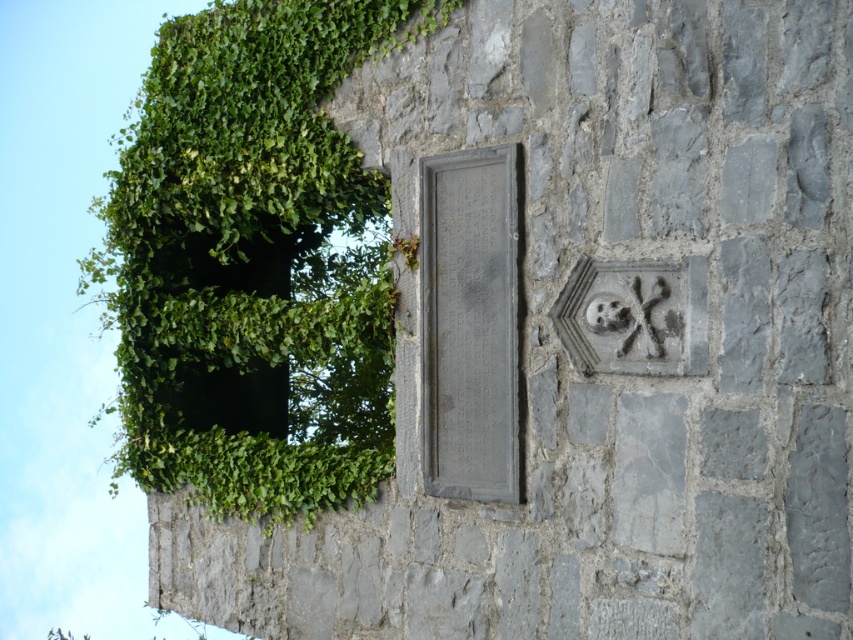
Question: Is green leafy plant at upper left bigger than gray stone plaque at center?

Choices:
 (A) yes
 (B) no

Answer: (A)

Question: Which point is closer to the camera taking this photo?

Choices:
 (A) (518, 483)
 (B) (271, 470)

Answer: (A)

Question: Does green leafy plant at upper left appear on the right side of gray stone plaque at center?

Choices:
 (A) no
 (B) yes

Answer: (A)

Question: Does green leafy plant at upper left have a lesser width compared to gray stone plaque at center?

Choices:
 (A) yes
 (B) no

Answer: (B)